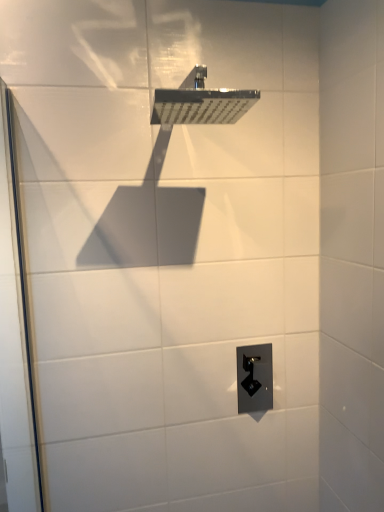
Question: Would you say black plastic outlet at lower center is a long distance from polished chrome shower head at upper center?

Choices:
 (A) no
 (B) yes

Answer: (A)

Question: Can we say black plastic outlet at lower center lies outside polished chrome shower head at upper center?

Choices:
 (A) no
 (B) yes

Answer: (B)

Question: Is black plastic outlet at lower center placed right next to polished chrome shower head at upper center?

Choices:
 (A) yes
 (B) no

Answer: (B)

Question: Is black plastic outlet at lower center to the right of polished chrome shower head at upper center from the viewer's perspective?

Choices:
 (A) no
 (B) yes

Answer: (B)

Question: Is black plastic outlet at lower center facing away from polished chrome shower head at upper center?

Choices:
 (A) no
 (B) yes

Answer: (A)

Question: Is black plastic outlet at lower center to the left of polished chrome shower head at upper center from the viewer's perspective?

Choices:
 (A) no
 (B) yes

Answer: (A)

Question: Does transparent glass screen door at left have a greater width compared to polished chrome shower head at upper center?

Choices:
 (A) no
 (B) yes

Answer: (A)

Question: Does transparent glass screen door at left appear on the right side of polished chrome shower head at upper center?

Choices:
 (A) yes
 (B) no

Answer: (B)

Question: Is the depth of transparent glass screen door at left greater than that of polished chrome shower head at upper center?

Choices:
 (A) no
 (B) yes

Answer: (A)

Question: Are transparent glass screen door at left and polished chrome shower head at upper center far apart?

Choices:
 (A) no
 (B) yes

Answer: (A)

Question: Does transparent glass screen door at left have a smaller size compared to polished chrome shower head at upper center?

Choices:
 (A) yes
 (B) no

Answer: (B)

Question: Is transparent glass screen door at left aimed at polished chrome shower head at upper center?

Choices:
 (A) yes
 (B) no

Answer: (B)

Question: Is polished chrome shower head at upper center to the right of black plastic outlet at lower center from the viewer's perspective?

Choices:
 (A) no
 (B) yes

Answer: (A)